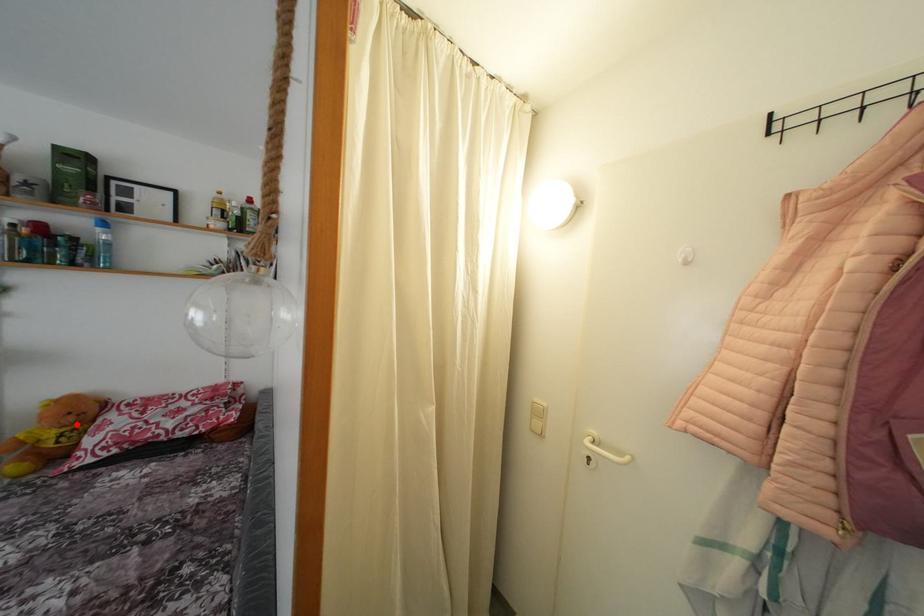
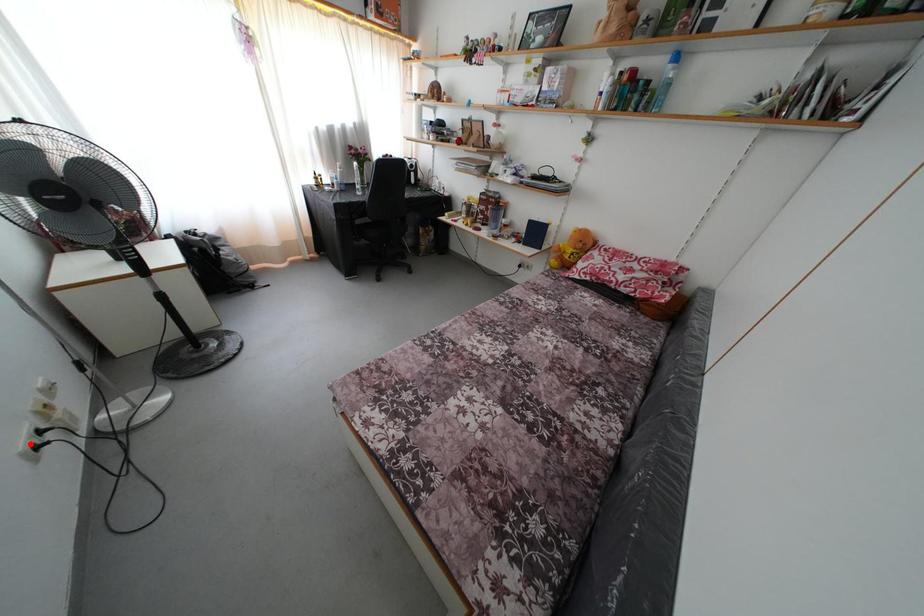
I am providing you with two images of the same scene from different viewpoints. A red point is marked on the first image and another point is marked on the second image. Do the highlighted points in image1 and image2 indicate the same real-world spot?

No